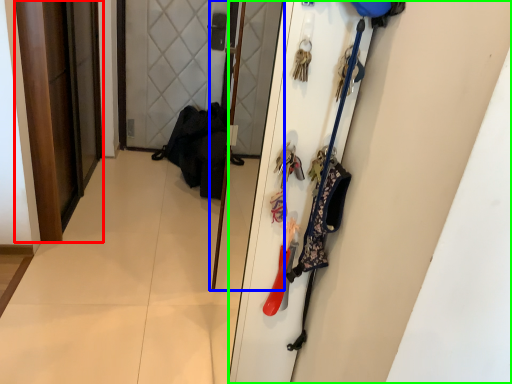
Question: Which object is the farthest from door (highlighted by a red box)? Choose among these: screen door (highlighted by a blue box) or door (highlighted by a green box).

Choices:
 (A) screen door
 (B) door

Answer: (B)